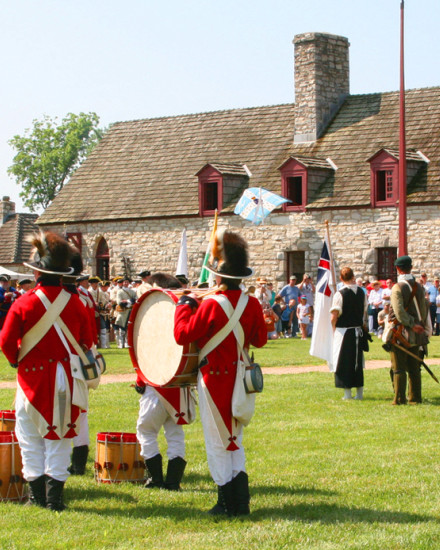
Identify the location of doors. This screenshot has height=550, width=440. (293, 262).